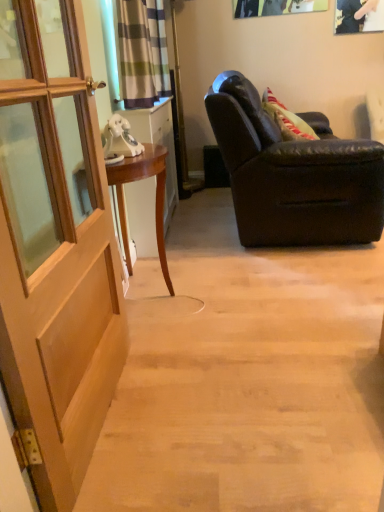
You are a GUI agent. You are given a task and a screenshot of the screen. Output one action in this format:
    pyautogui.click(x=<x>, y=<y>)
    Task: Click on the vacant area that lies between light brown wood door at left and matte black leather armchair at right
    Image resolution: width=384 pixels, height=512 pixels.
    Given the screenshot: What is the action you would take?
    pos(240,305)